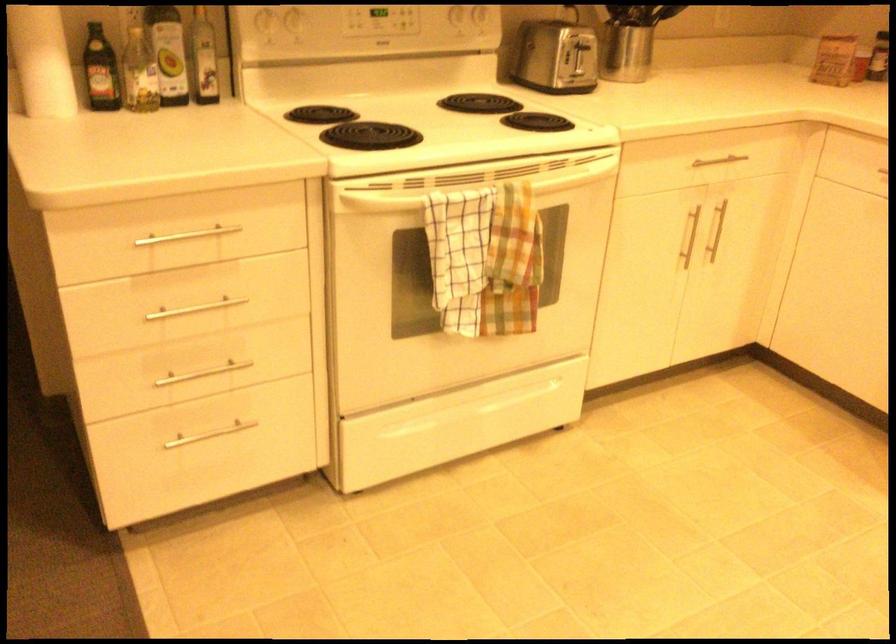
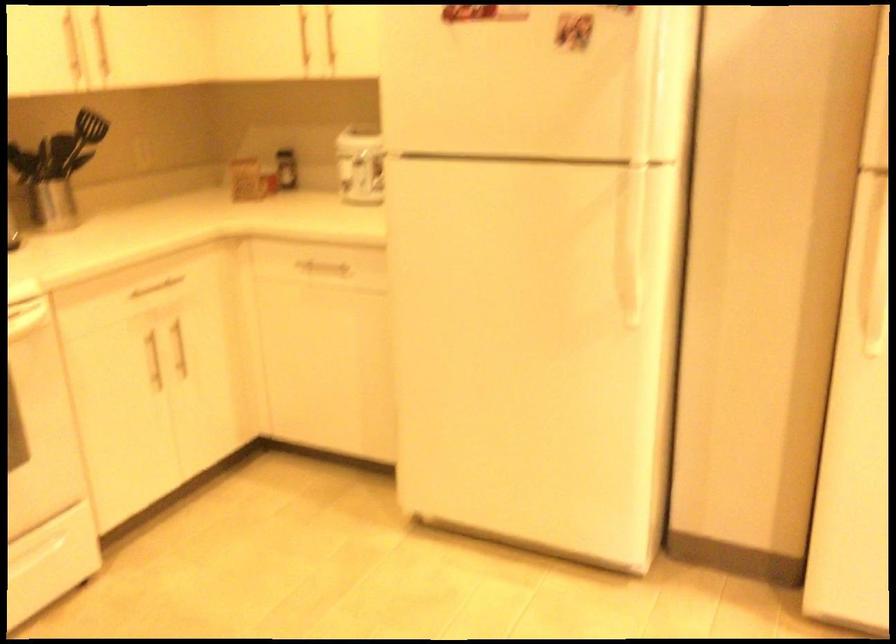
Where in the second image is the point corresponding to the point at 719,160 from the first image?

(159, 283)